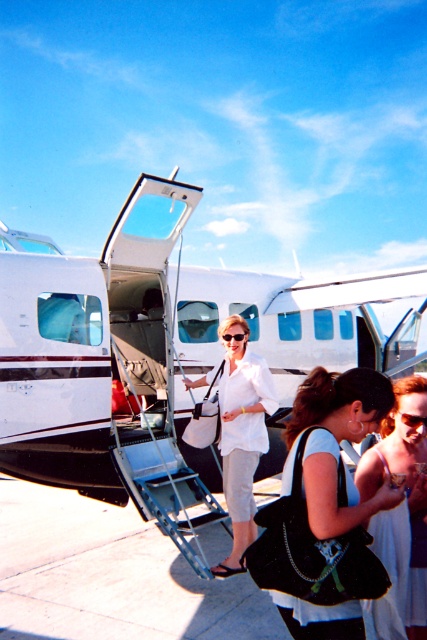
Does white fabric dress at center have a lesser height compared to white matte skirt at center?

Yes.

Find the location of a particular element. This screenshot has width=427, height=640. white fabric dress at center is located at coordinates (398, 515).

Between concrete tarmac at lower center and white fabric dress at center, which one appears on the right side from the viewer's perspective?

white fabric dress at center

Can you confirm if concrete tarmac at lower center is positioned to the left of white fabric dress at center?

Correct, you'll find concrete tarmac at lower center to the left of white fabric dress at center.

Locate an element on the screen. concrete tarmac at lower center is located at coordinates 111,577.

What are the coordinates of `concrete tarmac at lower center` in the screenshot? It's located at (111, 577).

Where is `white matte airplane at center`? This screenshot has height=640, width=427. white matte airplane at center is located at coordinates (160, 344).

Who is positioned more to the right, white matte airplane at center or white fabric dress at center?

white fabric dress at center is more to the right.

Identify the location of white matte airplane at center. The image size is (427, 640). (160, 344).